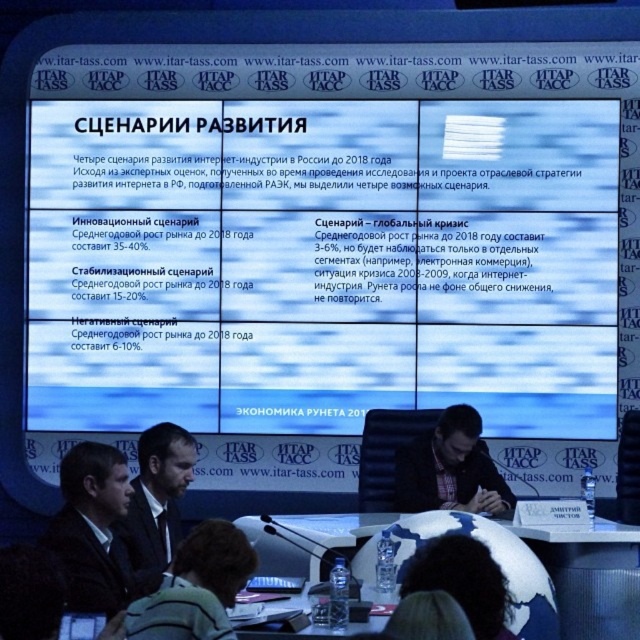
Between white paper at center and dark brown hair at center, which one appears on the right side from the viewer's perspective?

Positioned to the right is white paper at center.

Who is positioned more to the left, white paper at center or dark brown hair at center?

From the viewer's perspective, dark brown hair at center appears more on the left side.

Locate an element on the screen. The width and height of the screenshot is (640, 640). white paper at center is located at coordinates (321, 262).

Who is shorter, dark brown hair at center or dark hair at center?

With less height is dark brown hair at center.

The height and width of the screenshot is (640, 640). I want to click on dark brown hair at center, so click(195, 588).

Between white paper at center and dark suit at center, which one is positioned lower?

dark suit at center

Who is more forward, (513, 273) or (112, 605)?

Point (112, 605)

This screenshot has width=640, height=640. In order to click on white paper at center in this screenshot , I will do `click(321, 262)`.